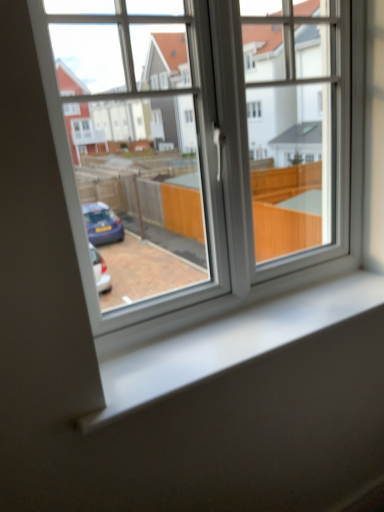
Question: Considering the relative sizes of white glossy window sill at center and white plastic window at center in the image provided, is white glossy window sill at center smaller than white plastic window at center?

Choices:
 (A) no
 (B) yes

Answer: (B)

Question: Does white glossy window sill at center have a lesser width compared to white plastic window at center?

Choices:
 (A) no
 (B) yes

Answer: (A)

Question: Can you confirm if white glossy window sill at center is positioned to the left of white plastic window at center?

Choices:
 (A) yes
 (B) no

Answer: (B)

Question: Can you confirm if white glossy window sill at center is bigger than white plastic window at center?

Choices:
 (A) no
 (B) yes

Answer: (A)

Question: From a real-world perspective, is white glossy window sill at center physically above white plastic window at center?

Choices:
 (A) yes
 (B) no

Answer: (B)

Question: From the image's perspective, is white glossy window sill at center above white plastic window at center?

Choices:
 (A) yes
 (B) no

Answer: (B)

Question: Is the depth of white plastic window at center less than that of white glossy window sill at center?

Choices:
 (A) yes
 (B) no

Answer: (A)

Question: Is white plastic window at center smaller than white glossy window sill at center?

Choices:
 (A) no
 (B) yes

Answer: (A)

Question: Considering the relative positions of white plastic window at center and white glossy window sill at center in the image provided, is white plastic window at center to the right of white glossy window sill at center from the viewer's perspective?

Choices:
 (A) yes
 (B) no

Answer: (B)

Question: Is the depth of white plastic window at center greater than that of white glossy window sill at center?

Choices:
 (A) yes
 (B) no

Answer: (B)

Question: Is white plastic window at center far away from white glossy window sill at center?

Choices:
 (A) yes
 (B) no

Answer: (B)

Question: Can you confirm if white plastic window at center is shorter than white glossy window sill at center?

Choices:
 (A) yes
 (B) no

Answer: (B)

Question: Is point (182, 338) positioned closer to the camera than point (170, 202)?

Choices:
 (A) farther
 (B) closer

Answer: (B)